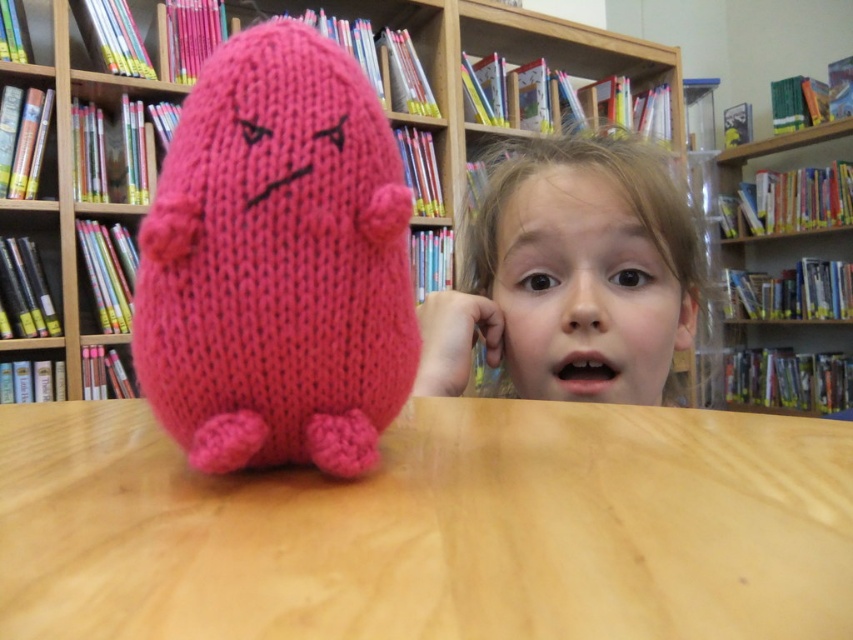
Can you confirm if matte pink plushie at center is positioned above wooden bookshelf at upper right?

Incorrect, matte pink plushie at center is not positioned above wooden bookshelf at upper right.

Who is more distant from viewer, (566, 353) or (728, 164)?

Point (728, 164)

I want to click on matte pink plushie at center, so click(585, 289).

Which is above, wooden table at center or wooden bookshelf at upper right?

Positioned higher is wooden bookshelf at upper right.

What are the coordinates of `wooden table at center` in the screenshot? It's located at (433, 529).

Does wooden table at center come in front of knitted pink plush at center?

Yes, wooden table at center is in front of knitted pink plush at center.

Can you confirm if wooden table at center is positioned to the left of knitted pink plush at center?

Correct, you'll find wooden table at center to the left of knitted pink plush at center.

Which is behind, point (700, 522) or point (277, 154)?

The point (277, 154) is more distant.

Where is `wooden table at center`? wooden table at center is located at coordinates (433, 529).